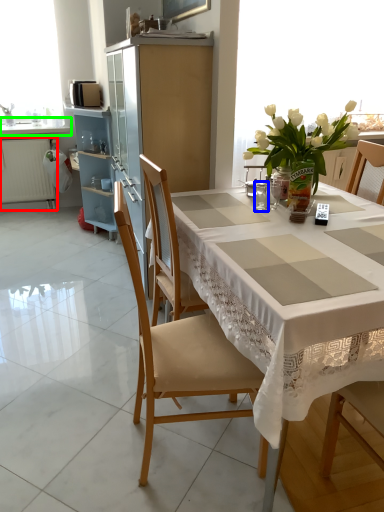
Question: Estimate the real-world distances between objects in this image. Which object is closer to radiator (highlighted by a red box), tableware (highlighted by a blue box) or countertop (highlighted by a green box)?

Choices:
 (A) tableware
 (B) countertop

Answer: (B)